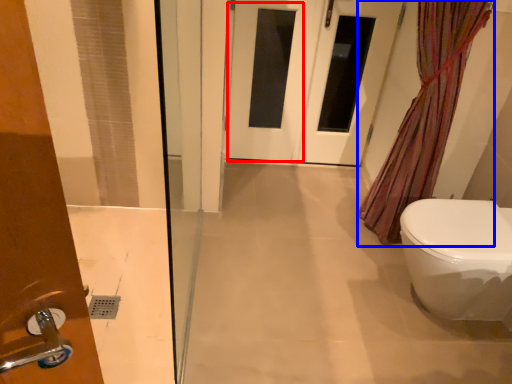
Question: Which of the following is the closest to the observer, screen door (highlighted by a red box) or shower curtain (highlighted by a blue box)?

Choices:
 (A) screen door
 (B) shower curtain

Answer: (B)